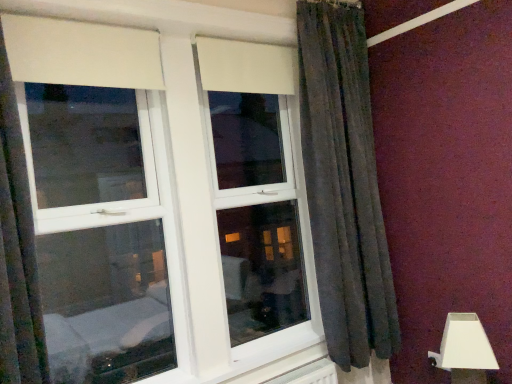
Question: Is white plastic table lamp at lower right inside the boundaries of white plastic window at upper center, or outside?

Choices:
 (A) inside
 (B) outside

Answer: (B)

Question: From a real-world perspective, is white plastic table lamp at lower right positioned above or below white plastic window at upper center?

Choices:
 (A) below
 (B) above

Answer: (A)

Question: Visually, is white plastic table lamp at lower right positioned to the left or to the right of white plastic window at upper center?

Choices:
 (A) left
 (B) right

Answer: (B)

Question: From a real-world perspective, relative to white plastic table lamp at lower right, is white plastic window at upper center vertically above or below?

Choices:
 (A) below
 (B) above

Answer: (B)

Question: Is white plastic window at upper center in front of or behind white plastic table lamp at lower right in the image?

Choices:
 (A) front
 (B) behind

Answer: (A)

Question: From the image's perspective, is white plastic window at upper center positioned above or below white plastic table lamp at lower right?

Choices:
 (A) below
 (B) above

Answer: (B)

Question: Is white plastic window at upper center inside the boundaries of white plastic table lamp at lower right, or outside?

Choices:
 (A) outside
 (B) inside

Answer: (A)